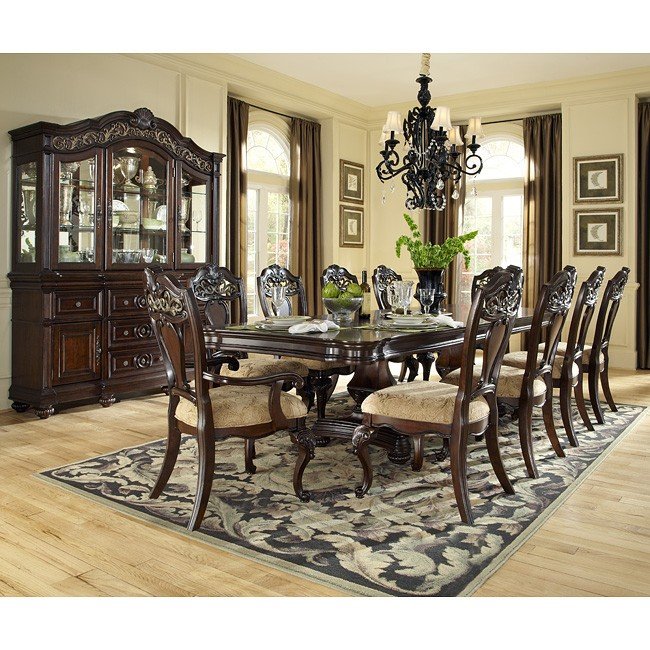
Identify the location of pictures on wall. (597, 233), (595, 186), (343, 222), (344, 182).